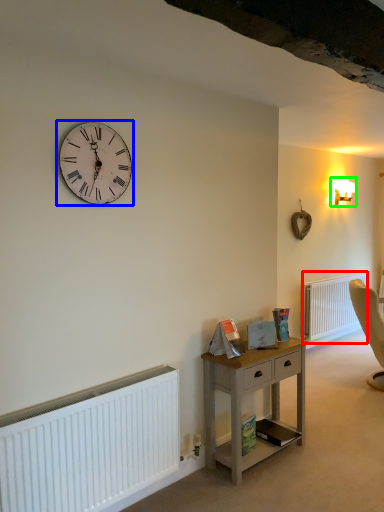
Question: Which is nearer to the radiator (highlighted by a red box)? wall clock (highlighted by a blue box) or light fixture (highlighted by a green box).

Choices:
 (A) wall clock
 (B) light fixture

Answer: (B)